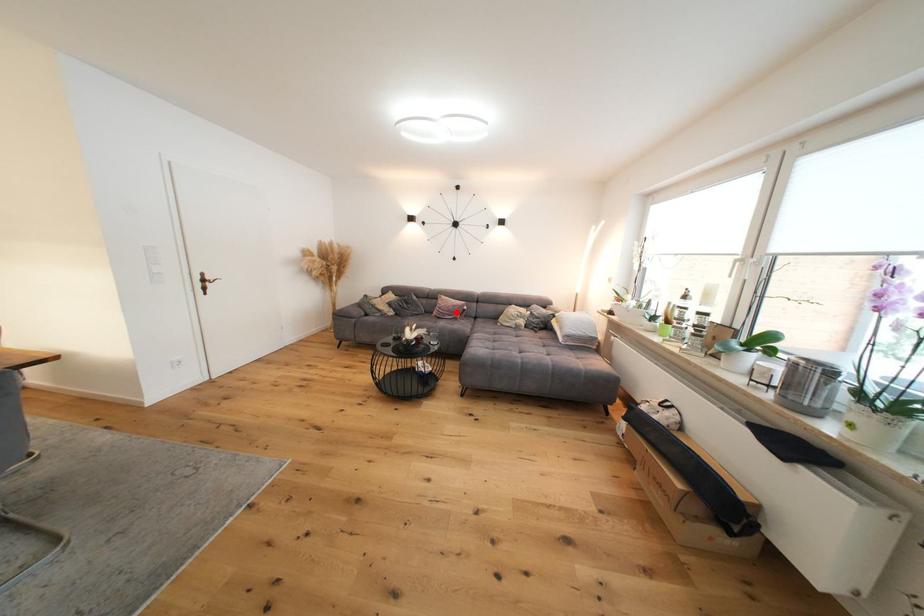
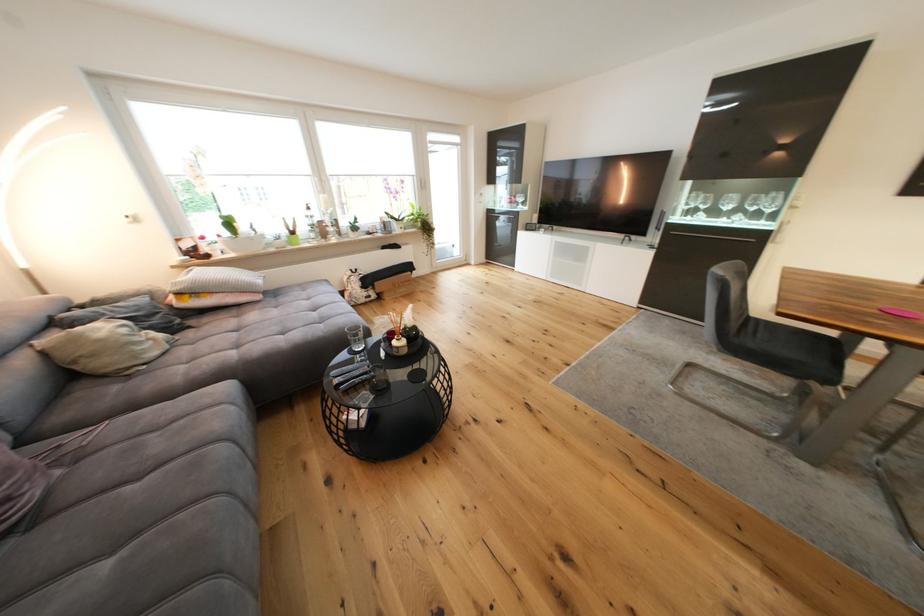
Where in the second image is the point corresponding to the highlighted location from the first image?

(18, 469)